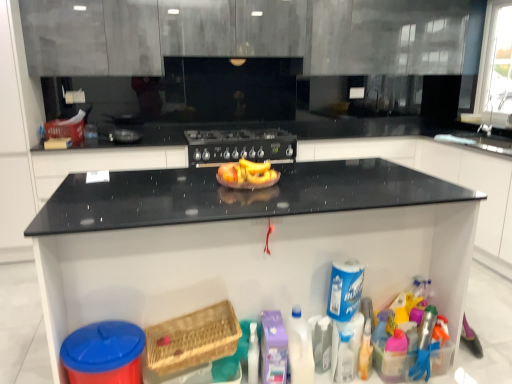
Describe the element at coordinates (245, 34) in the screenshot. I see `matte gray cabinets at upper center, which is counted as the 2th cabinetry, starting from the right` at that location.

The height and width of the screenshot is (384, 512). Describe the element at coordinates (104, 353) in the screenshot. I see `blue plastic bin at lower left, the second appliance when ordered from left to right` at that location.

The width and height of the screenshot is (512, 384). I want to click on blue plastic bin at lower left, placed as the first appliance when sorted from front to back, so click(104, 353).

Locate an element on the screen. shiny yellow bananas at center is located at coordinates (247, 175).

Locate an element on the screen. Image resolution: width=512 pixels, height=384 pixels. black granite countertop at center is located at coordinates (246, 241).

This screenshot has width=512, height=384. Find the location of `translucent plastic toy at lower right`. translucent plastic toy at lower right is located at coordinates (425, 345).

Is metallic silver toaster at center, which is the 1th appliance in back-to-front order, beside blue plastic bin at lower left, placed as the 2th appliance when sorted from top to bottom?

No, metallic silver toaster at center, which is the 1th appliance in back-to-front order, is not in contact with blue plastic bin at lower left, placed as the 2th appliance when sorted from top to bottom.

Choose the correct answer: Is metallic silver toaster at center, positioned as the first appliance in left-to-right order, inside blue plastic bin at lower left, acting as the 1th appliance starting from the right, or outside it?

metallic silver toaster at center, positioned as the first appliance in left-to-right order, is outside blue plastic bin at lower left, acting as the 1th appliance starting from the right.

Which point is more distant from viewer, (123, 114) or (101, 347)?

Positioned behind is point (123, 114).

Is metallic silver toaster at center, which is the 2th appliance from front to back, at the left side of blue plastic bin at lower left, the 2th appliance viewed from the back?

Yes, metallic silver toaster at center, which is the 2th appliance from front to back, is to the left of blue plastic bin at lower left, the 2th appliance viewed from the back.

Between shiny yellow bananas at center and black matte gas stove at center, which one has larger size?

black matte gas stove at center is bigger.

How many degrees apart are the facing directions of shiny yellow bananas at center and black matte gas stove at center?

There is a 1.65-degree angle between the facing directions of shiny yellow bananas at center and black matte gas stove at center.

Consider the image. Does shiny yellow bananas at center appear on the left side of black matte gas stove at center?

No, shiny yellow bananas at center is not to the left of black matte gas stove at center.

Considering the points (255, 166) and (250, 138), which point is in front, point (255, 166) or point (250, 138)?

The point (255, 166) is in front.

Does translucent plastic bottle at lower right contain black matte gas stove at center?

That's incorrect, black matte gas stove at center is not inside translucent plastic bottle at lower right.

Considering the positions of objects translucent plastic bottle at lower right and black matte gas stove at center in the image provided, who is behind, translucent plastic bottle at lower right or black matte gas stove at center?

black matte gas stove at center is more distant.

Between translucent plastic bottle at lower right and black matte gas stove at center, which one has smaller size?

translucent plastic bottle at lower right is smaller.

From a real-world perspective, between translucent plastic bottle at lower right and black matte gas stove at center, who is vertically lower?

translucent plastic bottle at lower right.

Is matte gray cabinets at upper center, marked as the first cabinetry in a top-to-bottom arrangement, located outside shiny yellow bananas at center?

Indeed, matte gray cabinets at upper center, marked as the first cabinetry in a top-to-bottom arrangement, is completely outside shiny yellow bananas at center.

Between matte gray cabinets at upper center, marked as the first cabinetry in a top-to-bottom arrangement, and shiny yellow bananas at center, which one has larger width?

matte gray cabinets at upper center, marked as the first cabinetry in a top-to-bottom arrangement.

Does point (199, 11) lie behind point (245, 172)?

Yes, point (199, 11) is farther from viewer.

From the image's perspective, is blue plastic bin at lower left, acting as the 1th appliance starting from the right, under black matte gas stove at center?

Yes.

Would you say black matte gas stove at center is part of blue plastic bin at lower left, the second appliance when ordered from left to right,'s contents?

Actually, black matte gas stove at center is outside blue plastic bin at lower left, the second appliance when ordered from left to right.

Which point is more distant from viewer, (x=119, y=335) or (x=279, y=157)?

Point (x=279, y=157)

Visually, is blue plastic bin at lower left, the second appliance when ordered from left to right, positioned to the left or to the right of black matte gas stove at center?

blue plastic bin at lower left, the second appliance when ordered from left to right, is to the left of black matte gas stove at center.

From a real-world perspective, is white matte cabinet at right, marked as the 2th cabinetry in a top-to-bottom arrangement, below translucent plastic toy at lower right?

Incorrect, from a real-world perspective, white matte cabinet at right, marked as the 2th cabinetry in a top-to-bottom arrangement, is higher than translucent plastic toy at lower right.

Considering the relative positions of white matte cabinet at right, marked as the 2th cabinetry in a top-to-bottom arrangement, and translucent plastic toy at lower right in the image provided, is white matte cabinet at right, marked as the 2th cabinetry in a top-to-bottom arrangement, to the left of translucent plastic toy at lower right from the viewer's perspective?

Answer: Incorrect, white matte cabinet at right, marked as the 2th cabinetry in a top-to-bottom arrangement, is not on the left side of translucent plastic toy at lower right.

Considering the sizes of objects white matte cabinet at right, placed as the second cabinetry when sorted from left to right, and translucent plastic toy at lower right in the image provided, who is taller, white matte cabinet at right, placed as the second cabinetry when sorted from left to right, or translucent plastic toy at lower right?

white matte cabinet at right, placed as the second cabinetry when sorted from left to right, is taller.

In the scene shown: Does white matte cabinet at right, which appears as the 1th cabinetry when ordered from the bottom, have a lesser width compared to translucent plastic toy at lower right?

Incorrect, the width of white matte cabinet at right, which appears as the 1th cabinetry when ordered from the bottom, is not less than that of translucent plastic toy at lower right.

How many degrees apart are the facing directions of black granite countertop at center and metallic silver toaster at center, arranged as the first appliance when viewed from the top?

There is a 1.38-degree angle between the facing directions of black granite countertop at center and metallic silver toaster at center, arranged as the first appliance when viewed from the top.

Image resolution: width=512 pixels, height=384 pixels. There is a black granite countertop at center. In order to click on appliance above it (from a real-world perspective) in this screenshot , I will do `click(124, 128)`.

From the image's perspective, relative to metallic silver toaster at center, which is the 1th appliance in back-to-front order, is black granite countertop at center above or below?

Based on their image positions, black granite countertop at center is located beneath metallic silver toaster at center, which is the 1th appliance in back-to-front order.

Is black granite countertop at center next to metallic silver toaster at center, which is the 1th appliance in back-to-front order, and touching it?

No, black granite countertop at center is not beside metallic silver toaster at center, which is the 1th appliance in back-to-front order.

At what (x,y) coordinates should I click in order to perform the action: click on appliance that is on the right side of metallic silver toaster at center, which is the 1th appliance in back-to-front order. Please return your answer as a coordinate pair (x, y). The height and width of the screenshot is (384, 512). Looking at the image, I should click on (104, 353).

The width and height of the screenshot is (512, 384). In order to click on food below the black matte gas stove at center (from the image's perspective) in this screenshot , I will do `click(247, 175)`.

Based on their spatial positions, is blue plastic bin at lower left, the 2th appliance viewed from the back, or translucent plastic bottle at lower right closer to metallic silver toaster at center, arranged as the first appliance when viewed from the top?

blue plastic bin at lower left, the 2th appliance viewed from the back.

Looking at the image, which one is located further to white plastic bottle at lower right, blue plastic bin at lower left, acting as the 1th appliance starting from the right, or white matte cabinet at right, which appears as the 1th cabinetry when ordered from the bottom?

Based on the image, white matte cabinet at right, which appears as the 1th cabinetry when ordered from the bottom, appears to be further to white plastic bottle at lower right.

Looking at the image, which one is located closer to woven wood basket at lower center, white plastic bottle at lower right or translucent plastic toy at lower right?

Based on the image, white plastic bottle at lower right appears to be nearer to woven wood basket at lower center.

From the image, which object appears to be nearer to translucent plastic toy at lower right, blue plastic bin at lower left, acting as the 1th appliance starting from the right, or white plastic bottle at lower right?

white plastic bottle at lower right is positioned closer to the anchor translucent plastic toy at lower right.

Estimate the real-world distances between objects in this image. Which object is closer to black matte gas stove at center, white plastic bottle at lower right or white matte cabinet at right, placed as the second cabinetry when sorted from left to right?

The object closer to black matte gas stove at center is white matte cabinet at right, placed as the second cabinetry when sorted from left to right.

From the image, which object appears to be farther from metallic silver toaster at center, arranged as the first appliance when viewed from the top, white matte cabinet at right, which appears as the 1th cabinetry when ordered from the bottom, or blue plastic bin at lower left, acting as the 1th appliance starting from the right?

Among the two, white matte cabinet at right, which appears as the 1th cabinetry when ordered from the bottom, is located further to metallic silver toaster at center, arranged as the first appliance when viewed from the top.

Which object lies further to the anchor point translucent plastic bottle at lower right, matte gray cabinets at upper center, marked as the first cabinetry in a top-to-bottom arrangement, or translucent plastic toy at lower right?

matte gray cabinets at upper center, marked as the first cabinetry in a top-to-bottom arrangement, is positioned further to the anchor translucent plastic bottle at lower right.

Considering their positions, is black matte gas stove at center positioned closer to matte gray cabinets at upper center, marked as the first cabinetry in a top-to-bottom arrangement, than shiny yellow bananas at center?

black matte gas stove at center lies closer to matte gray cabinets at upper center, marked as the first cabinetry in a top-to-bottom arrangement, than the other object.

Find the location of a particular element. toy between translucent plastic bottle at lower right and white matte cabinet at right, the first cabinetry from the right is located at coordinates (425, 345).

Locate an element on the screen. Image resolution: width=512 pixels, height=384 pixels. cabinetry between shiny yellow bananas at center and white matte cabinet at right, placed as the second cabinetry when sorted from left to right, in the horizontal direction is located at coordinates (245, 34).

Find the location of a particular element. The image size is (512, 384). countertop that lies between shiny yellow bananas at center and woven wood basket at lower center from top to bottom is located at coordinates (246, 241).

Find the location of a particular element. toy between matte gray cabinets at upper center, which is counted as the 2th cabinetry, starting from the right, and white plastic bottle at lower right in the up-down direction is located at coordinates (425, 345).